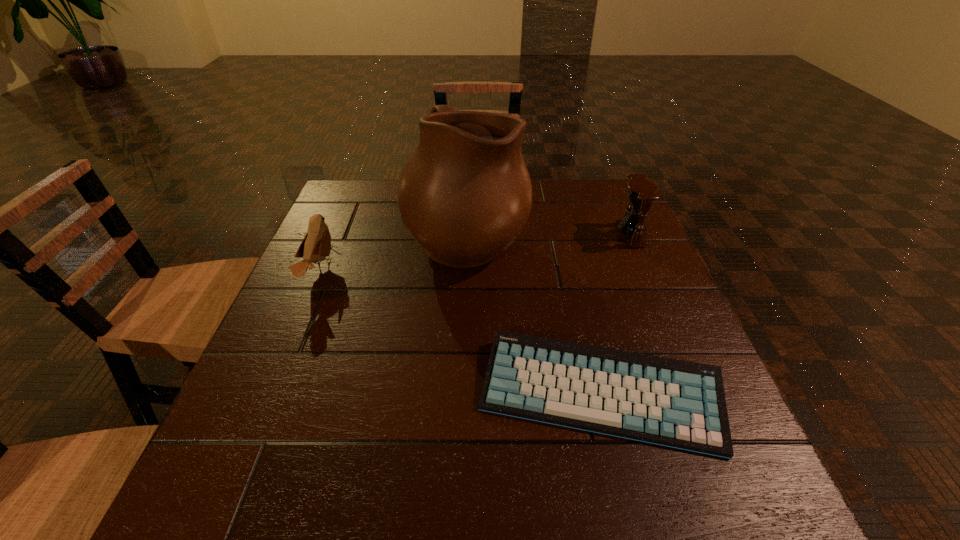
The width and height of the screenshot is (960, 540). In the image, there is a desktop. Find the location of `free space at the far left corner`. free space at the far left corner is located at coordinates (365, 196).

You are a GUI agent. You are given a task and a screenshot of the screen. Output one action in this format:
    pyautogui.click(x=<x>, y=<y>)
    Task: Click on the vacant space at the far right corner of the desktop
    This screenshot has height=540, width=960.
    Given the screenshot: What is the action you would take?
    pyautogui.click(x=601, y=198)

In order to click on vacant space at the near right corner in this screenshot , I will do `click(742, 478)`.

This screenshot has height=540, width=960. In order to click on free space between the shortest object and the leftmost object in this screenshot , I will do `click(460, 333)`.

Identify the location of empty location between the tallest object and the shortest object. The image size is (960, 540). (534, 315).

Find the location of a particular element. The height and width of the screenshot is (540, 960). vacant region between the cream pitcher and the nearest object is located at coordinates (534, 315).

Locate an element on the screen. empty location between the leftmost object and the tallest object is located at coordinates (394, 254).

Locate an element on the screen. free area in between the computer keyboard and the third tallest object is located at coordinates (460, 333).

This screenshot has height=540, width=960. Identify the location of vacant space that is in between the leftmost object and the nearest object. [460, 333].

The height and width of the screenshot is (540, 960). In order to click on free space that is in between the hourglass and the tallest object in this screenshot , I will do pyautogui.click(x=548, y=235).